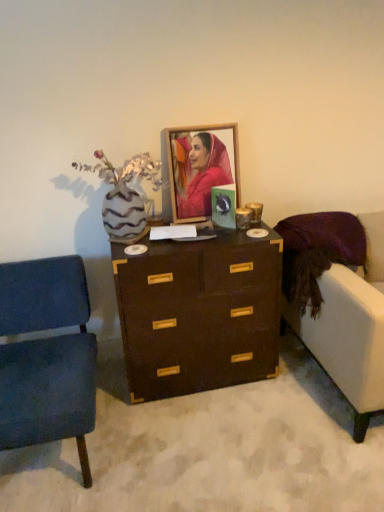
What are the coordinates of `free space between brown wood chest of drawers at center and velvet blue chair at left` in the screenshot? It's located at (172, 426).